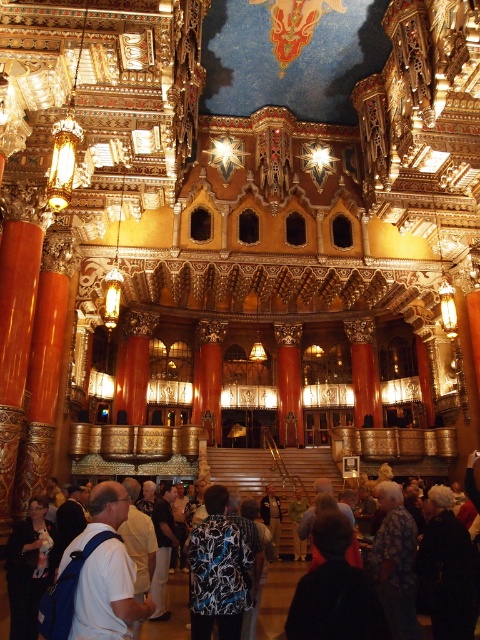
How distant is floral shirt at center from floral-patterned shirt at center?

24.69 meters

Based on the photo, can you confirm if floral shirt at center is positioned below floral-patterned shirt at center?

Incorrect, floral shirt at center is not positioned below floral-patterned shirt at center.

Describe the element at coordinates (217, 570) in the screenshot. I see `floral shirt at center` at that location.

Find the location of a particular element. The width and height of the screenshot is (480, 640). floral shirt at center is located at coordinates (217, 570).

Does point (17, 524) come in front of point (154, 593)?

No, it is behind (154, 593).

Can you confirm if matte black jacket at lower left is positioned to the right of dark blue shirt at center?

Incorrect, matte black jacket at lower left is not on the right side of dark blue shirt at center.

Is point (43, 509) farther from viewer compared to point (156, 584)?

That is False.

Where is `matte black jacket at lower left`? This screenshot has height=640, width=480. matte black jacket at lower left is located at coordinates (28, 568).

Who is taller, floral shirt at center or black fabric at lower right?

With more height is floral shirt at center.

Is point (232, 568) farther from camera compared to point (469, 582)?

No, (232, 568) is closer to viewer.

Does point (223, 529) come closer to viewer compared to point (464, 592)?

No.

The image size is (480, 640). What are the coordinates of `floral shirt at center` in the screenshot? It's located at (217, 570).